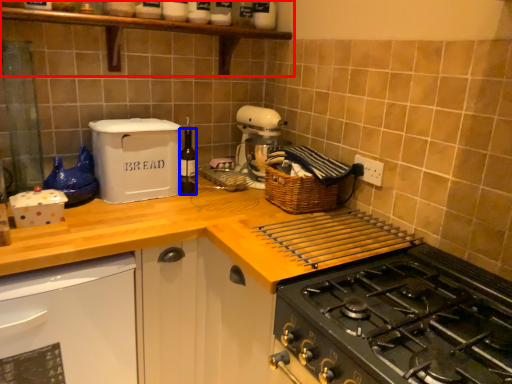
Question: Which object appears closest to the camera in this image, shelf (highlighted by a red box) or bottle (highlighted by a blue box)?

Choices:
 (A) shelf
 (B) bottle

Answer: (A)